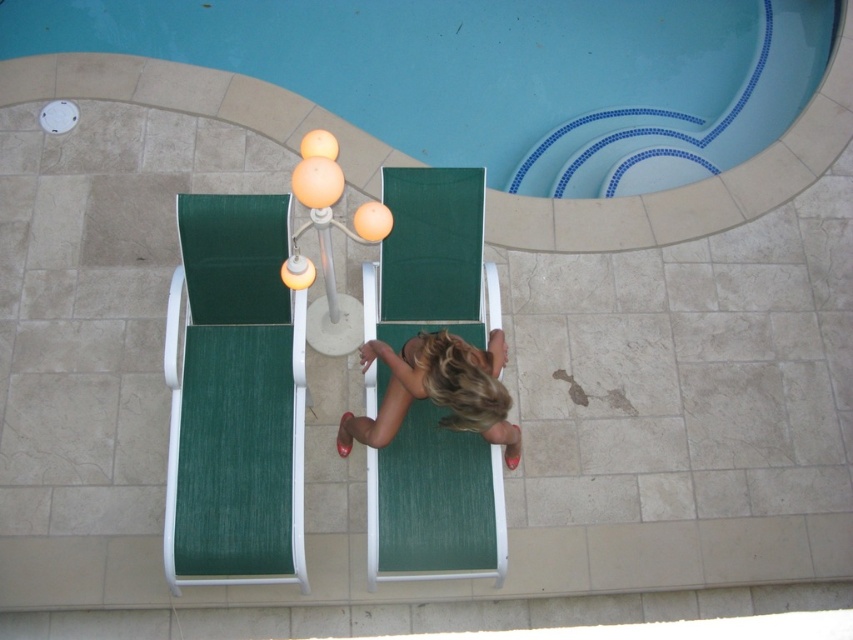
You are planning to place a new rectangular sunshade over the blue tile swimming pool at upper center and the green fabric beach chair at left. The sunshade can only cover an area equal to the combined width of both objects. Will the sunshade be sufficient to cover both?

The blue tile swimming pool at upper center has a larger width than the green fabric beach chair at left. Since the sunshade covers the combined width of both, it will be sufficient to cover both objects.